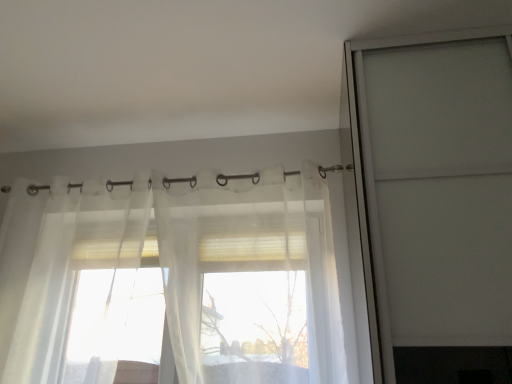
Question: Choose the correct answer: Is translucent fabric curtain at upper center inside sheer white curtain at center or outside it?

Choices:
 (A) outside
 (B) inside

Answer: (B)

Question: From a real-world perspective, is translucent fabric curtain at upper center positioned above or below sheer white curtain at center?

Choices:
 (A) above
 (B) below

Answer: (A)

Question: Which object is positioned closest to the sheer white curtain at center?

Choices:
 (A) transparent glass screen door at upper right
 (B) translucent fabric curtain at upper center

Answer: (B)

Question: Which object is the farthest from the translucent fabric curtain at upper center?

Choices:
 (A) transparent glass screen door at upper right
 (B) sheer white curtain at center

Answer: (B)